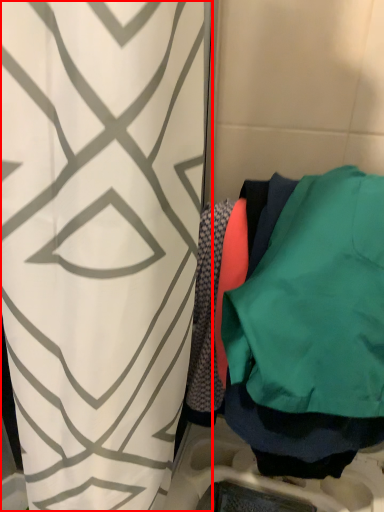
Question: From the image's perspective, what is the correct spatial relationship of curtain (annotated by the red box) in relation to sweatshirt?

Choices:
 (A) below
 (B) above

Answer: (A)